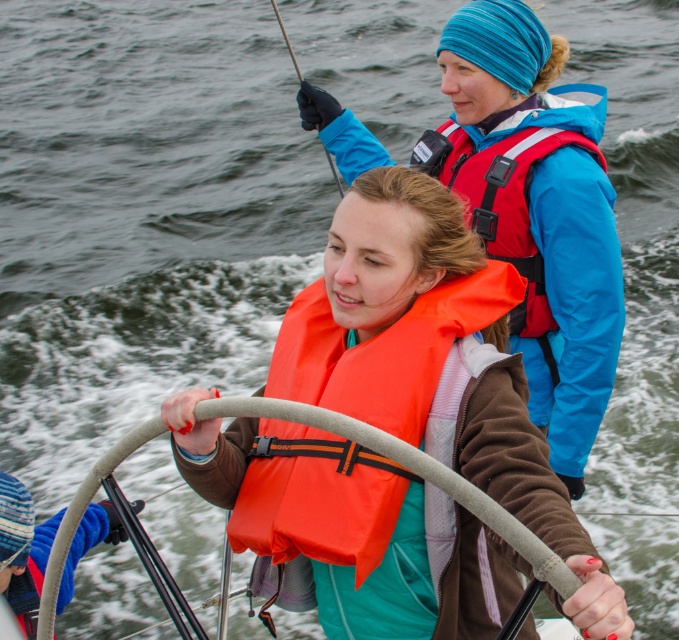
Question: Is orange matte life jacket at upper center smaller than blue fleece glove at center?

Choices:
 (A) yes
 (B) no

Answer: (B)

Question: Is orange life vest at center smaller than blue fleece glove at center?

Choices:
 (A) no
 (B) yes

Answer: (A)

Question: Does orange life vest at center have a lesser width compared to orange matte life jacket at center?

Choices:
 (A) yes
 (B) no

Answer: (B)

Question: Among these objects, which one is farthest from the camera?

Choices:
 (A) orange matte life jacket at upper center
 (B) blue fleece glove at center

Answer: (A)

Question: Which object is the closest to the blue fleece glove at center?

Choices:
 (A) orange matte life jacket at upper center
 (B) orange matte life jacket at center
 (C) orange life vest at center

Answer: (B)

Question: Which point is closer to the camera?

Choices:
 (A) blue fleece glove at center
 (B) orange life vest at center

Answer: (A)